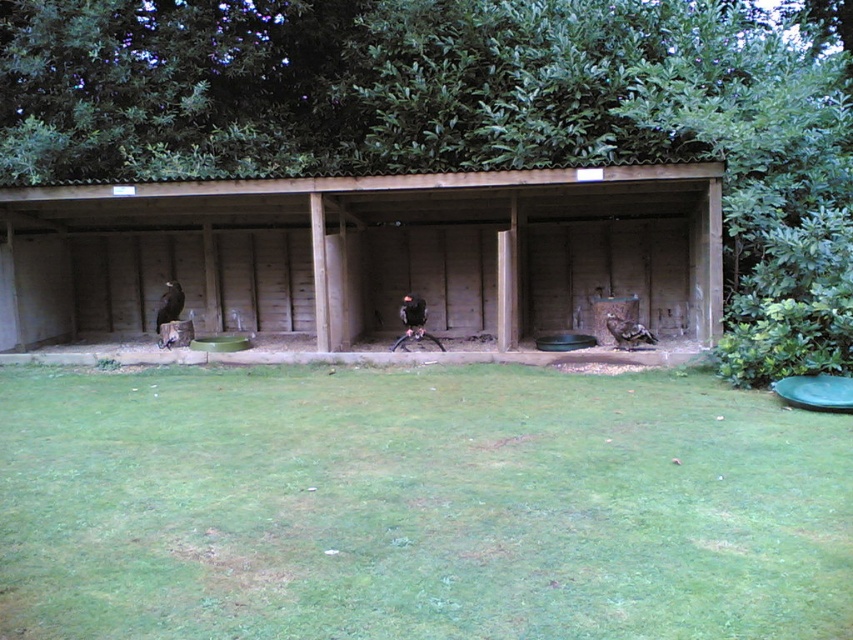
Is green grass at center to the right of brown wooden hut at center from the viewer's perspective?

Indeed, green grass at center is positioned on the right side of brown wooden hut at center.

Between green grass at center and brown wooden hut at center, which one is positioned higher?

brown wooden hut at center is above.

The image size is (853, 640). Identify the location of green grass at center. (416, 506).

Locate an element on the screen. green grass at center is located at coordinates (416, 506).